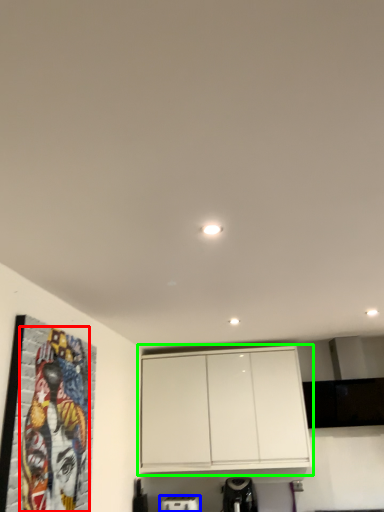
Question: Estimate the real-world distances between objects in this image. Which object is closer to mural (highlighted by a red box), appliance (highlighted by a blue box) or cabinetry (highlighted by a green box)?

Choices:
 (A) appliance
 (B) cabinetry

Answer: (B)